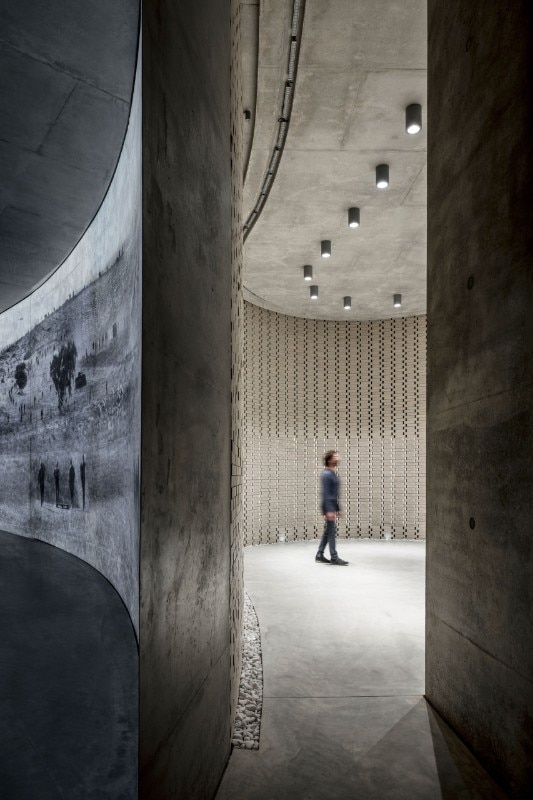
Identify the location of walls. (x=484, y=554), (x=192, y=582), (x=390, y=478).